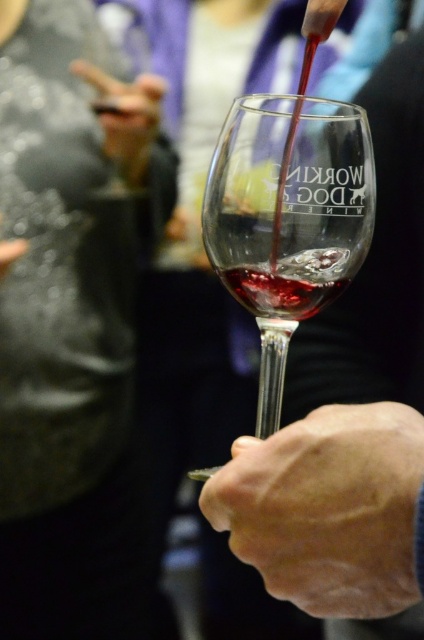
Question: Which object is closer to the camera taking this photo?

Choices:
 (A) smooth leather glove at upper left
 (B) transparent glass at center
 (C) black leather jacket at upper left
 (D) smooth skin hand at center

Answer: (D)

Question: Can you confirm if black leather jacket at upper left is thinner than smooth skin hand at center?

Choices:
 (A) no
 (B) yes

Answer: (A)

Question: Is smooth skin hand at center thinner than translucent glass at center?

Choices:
 (A) no
 (B) yes

Answer: (A)

Question: Does black leather jacket at upper left have a lesser width compared to smooth skin hand at center?

Choices:
 (A) yes
 (B) no

Answer: (B)

Question: Estimate the real-world distances between objects in this image. Which object is farther from the translucent glass at center?

Choices:
 (A) transparent glass at center
 (B) smooth skin hand at center

Answer: (B)

Question: Based on their relative distances, which object is nearer to the transparent glass at center?

Choices:
 (A) smooth skin hand at center
 (B) smooth leather glove at upper left

Answer: (A)